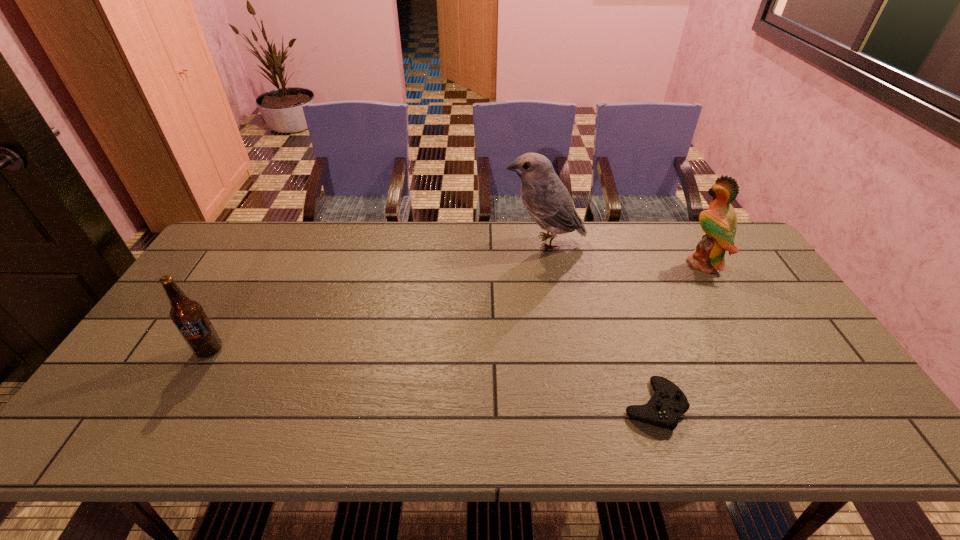
Where is `free spot located on the front-facing side of the right parrot`? free spot located on the front-facing side of the right parrot is located at coordinates (662, 264).

Where is `vacant region located 0.340m on the front-facing side of the right parrot`? This screenshot has height=540, width=960. vacant region located 0.340m on the front-facing side of the right parrot is located at coordinates (579, 264).

You are a GUI agent. You are given a task and a screenshot of the screen. Output one action in this format:
    pyautogui.click(x=<x>, y=<y>)
    Task: Click on the vacant space situated on the label of the leftmost object
    This screenshot has height=540, width=960.
    Given the screenshot: What is the action you would take?
    pyautogui.click(x=184, y=394)

Where is `vacant space located on the right of the control`? Image resolution: width=960 pixels, height=540 pixels. vacant space located on the right of the control is located at coordinates (735, 405).

The width and height of the screenshot is (960, 540). I want to click on object at the near edge, so click(667, 404).

At what (x,y) coordinates should I click in order to perform the action: click on object present at the left edge. Please return your answer as a coordinate pair (x, y). This screenshot has height=540, width=960. Looking at the image, I should click on (188, 316).

Find the location of a particular element. This screenshot has width=960, height=540. object at the right edge is located at coordinates (719, 222).

The height and width of the screenshot is (540, 960). I want to click on object located in the far right corner section of the desktop, so click(x=719, y=222).

The width and height of the screenshot is (960, 540). In order to click on vacant space at the far edge of the desktop in this screenshot , I will do `click(678, 258)`.

Where is `vacant space at the near edge of the desktop`? The width and height of the screenshot is (960, 540). vacant space at the near edge of the desktop is located at coordinates (378, 426).